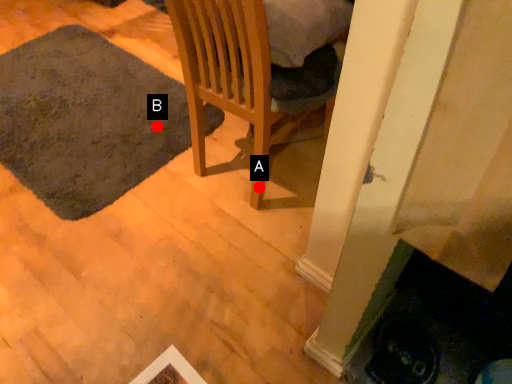
Question: Two points are circled on the image, labeled by A and B beside each circle. Which point is closer to the camera?

Choices:
 (A) A is closer
 (B) B is closer

Answer: (A)